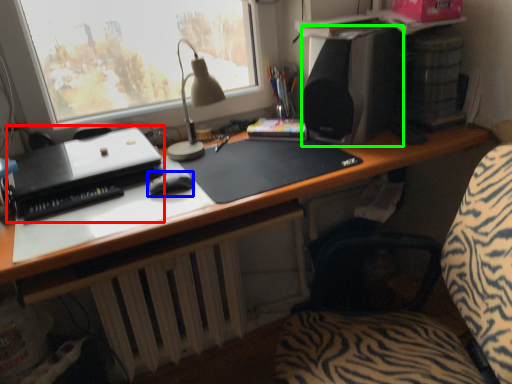
Question: Which object is positioned closest to printer (highlighted by a red box)? Select from mouse (highlighted by a blue box) and loudspeaker (highlighted by a green box).

Choices:
 (A) mouse
 (B) loudspeaker

Answer: (A)